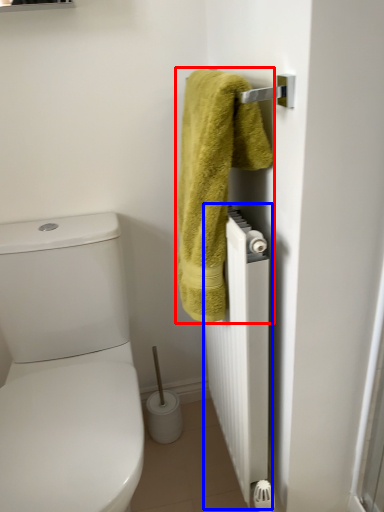
Question: Among these objects, which one is farthest to the camera, towel (highlighted by a red box) or radiator (highlighted by a blue box)?

Choices:
 (A) towel
 (B) radiator

Answer: (B)